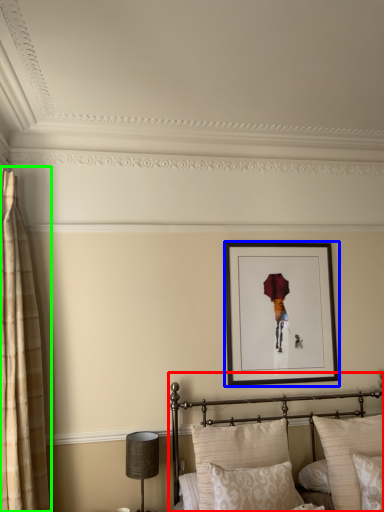
Question: Estimate the real-world distances between objects in this image. Which object is farther from bed (highlighted by a red box), picture frame (highlighted by a blue box) or curtain (highlighted by a green box)?

Choices:
 (A) picture frame
 (B) curtain

Answer: (B)